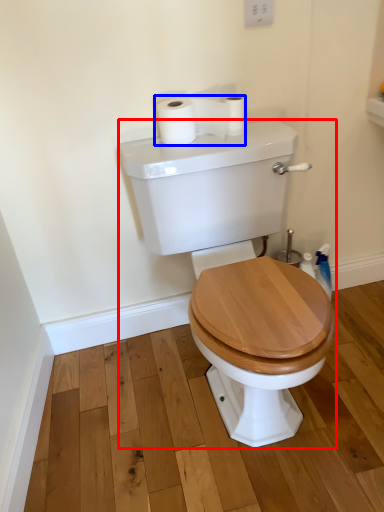
Question: Among these objects, which one is farthest to the camera, porcelain (highlighted by a red box) or toilet paper (highlighted by a blue box)?

Choices:
 (A) porcelain
 (B) toilet paper

Answer: (B)